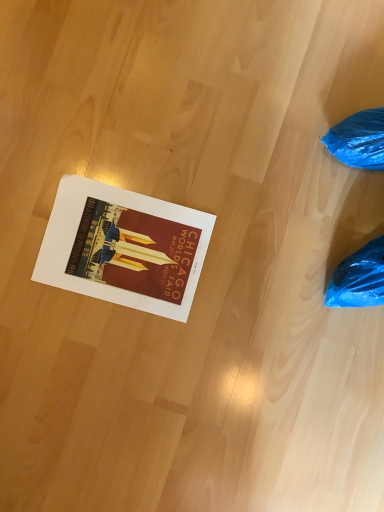
The image size is (384, 512). What do you see at coordinates (124, 247) in the screenshot?
I see `matte paper poster at center` at bounding box center [124, 247].

Find the location of a particular element. The image size is (384, 512). matte paper poster at center is located at coordinates (124, 247).

Find the location of a particular element. matte paper poster at center is located at coordinates tap(124, 247).